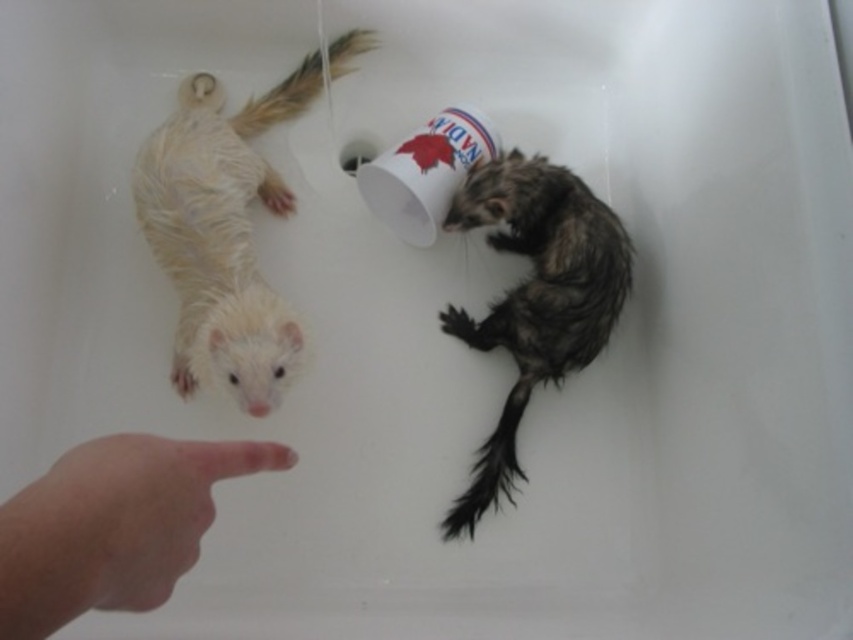
Question: Among these objects, which one is nearest to the camera?

Choices:
 (A) dark brown fur ferret at right
 (B) fluffy white tail at upper center
 (C) black fuzzy tail at lower center
 (D) white paper cup at upper center

Answer: (C)

Question: Does flesh-toned skin at lower left appear on the right side of dark brown fur ferret at right?

Choices:
 (A) no
 (B) yes

Answer: (A)

Question: Can you confirm if white fur ferret at upper left is positioned to the right of flesh-toned skin at lower left?

Choices:
 (A) yes
 (B) no

Answer: (B)

Question: Does white paper cup at upper center appear over fluffy white tail at upper center?

Choices:
 (A) yes
 (B) no

Answer: (B)

Question: Considering the real-world distances, which object is farthest from the fluffy white tail at upper center?

Choices:
 (A) white paper cup at upper center
 (B) dark brown fur ferret at right
 (C) white fur ferret at upper left

Answer: (B)

Question: Which of the following is the closest to the observer?

Choices:
 (A) flesh-toned skin at lower left
 (B) fluffy white tail at upper center
 (C) white fur ferret at upper left
 (D) white paper cup at upper center

Answer: (A)